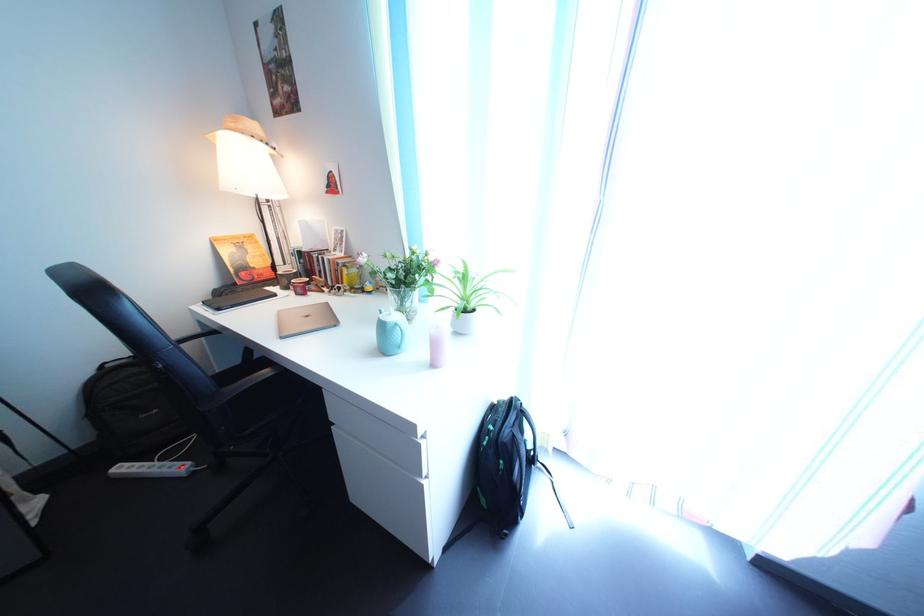
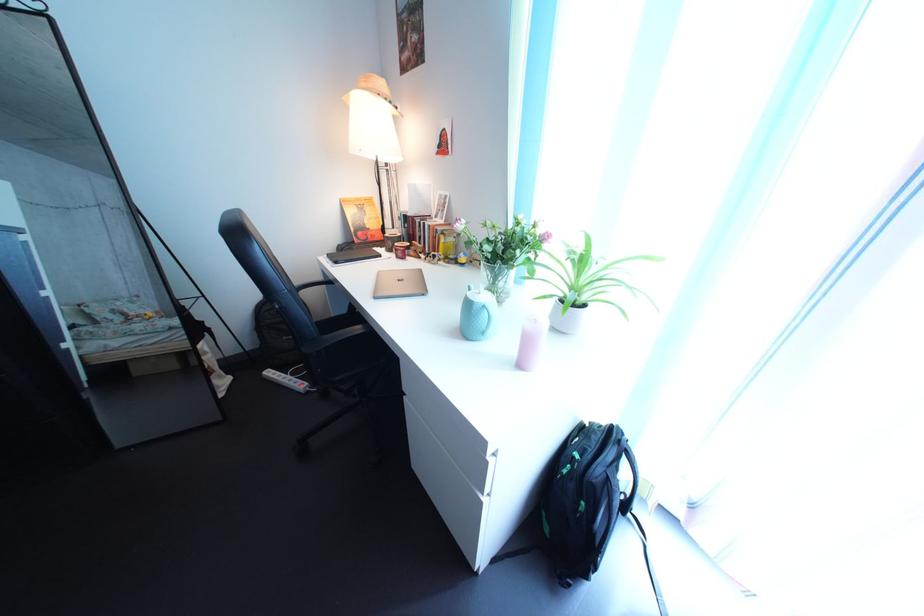
The point at (396, 334) is marked in the first image. Where is the corresponding point in the second image?

(482, 313)